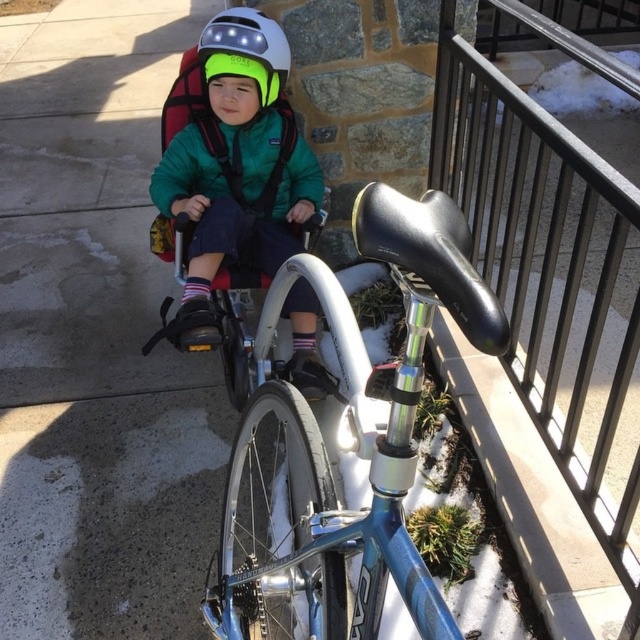
Question: Is black metal railing at upper right below white matte helmet at upper center?

Choices:
 (A) no
 (B) yes

Answer: (B)

Question: Which object is positioned farthest from the white matte helmet at upper center?

Choices:
 (A) black metal railing at upper right
 (B) green matte jacket at center

Answer: (A)

Question: Which point is closer to the camera taking this photo?

Choices:
 (A) (237, 54)
 (B) (605, 452)
 (C) (282, 60)

Answer: (B)

Question: Considering the relative positions of shiny blue frame at center and white matte helmet at upper center in the image provided, where is shiny blue frame at center located with respect to white matte helmet at upper center?

Choices:
 (A) above
 (B) below

Answer: (B)

Question: From the image, what is the correct spatial relationship of black metal railing at upper right in relation to shiny blue frame at center?

Choices:
 (A) right
 (B) left

Answer: (A)

Question: Among these points, which one is farthest from the camera?

Choices:
 (A) (237, 49)
 (B) (445, 189)

Answer: (B)